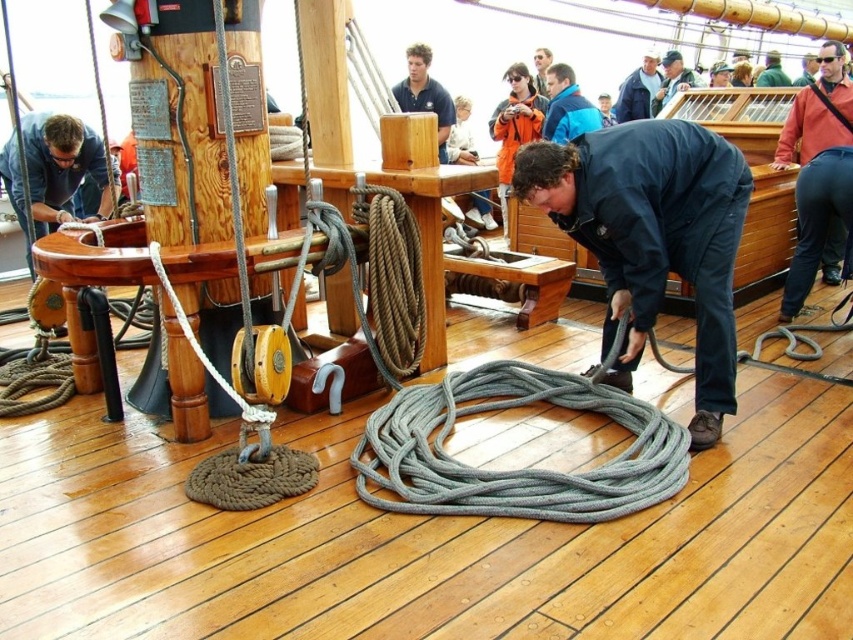
Is point (633, 296) closer to camera compared to point (618, 115)?

Yes.

Which is in front, point (705, 180) or point (616, 108)?

Point (705, 180) is in front.

Identify the location of dark blue fabric at center. (653, 236).